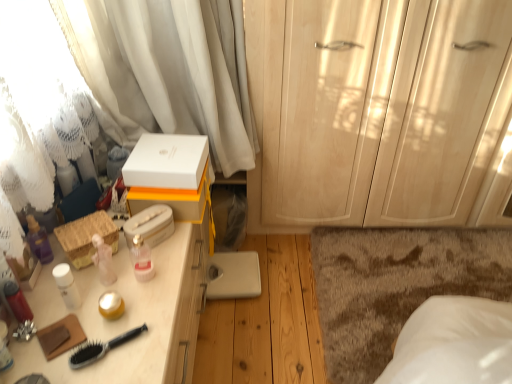
Locate an element on the screen. The height and width of the screenshot is (384, 512). free point behind black plastic brush at lower left is located at coordinates (124, 289).